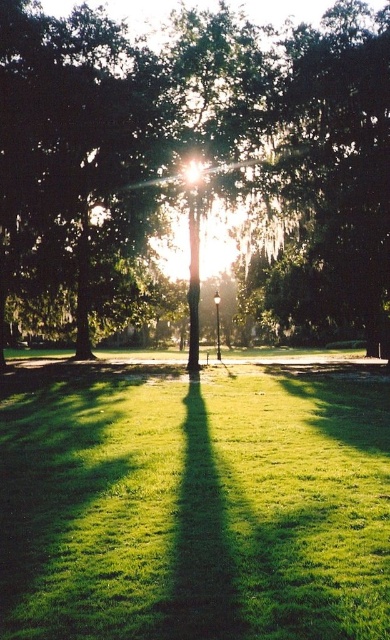
Question: Is green leafy tree at center wider than green grassy at center?

Choices:
 (A) no
 (B) yes

Answer: (B)

Question: Does green leafy tree at center have a smaller size compared to green grassy at center?

Choices:
 (A) yes
 (B) no

Answer: (B)

Question: Which point appears farthest from the camera in this image?

Choices:
 (A) (287, 260)
 (B) (31, 492)

Answer: (A)

Question: Which point is farther to the camera?

Choices:
 (A) green grassy at center
 (B) green leafy tree at center

Answer: (B)

Question: Does green leafy tree at center appear under green grassy at center?

Choices:
 (A) no
 (B) yes

Answer: (A)